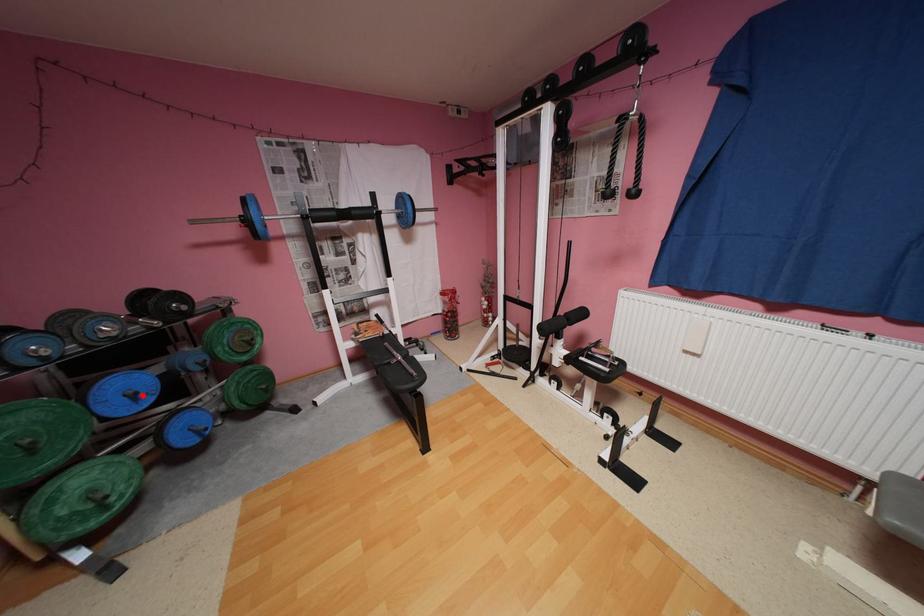
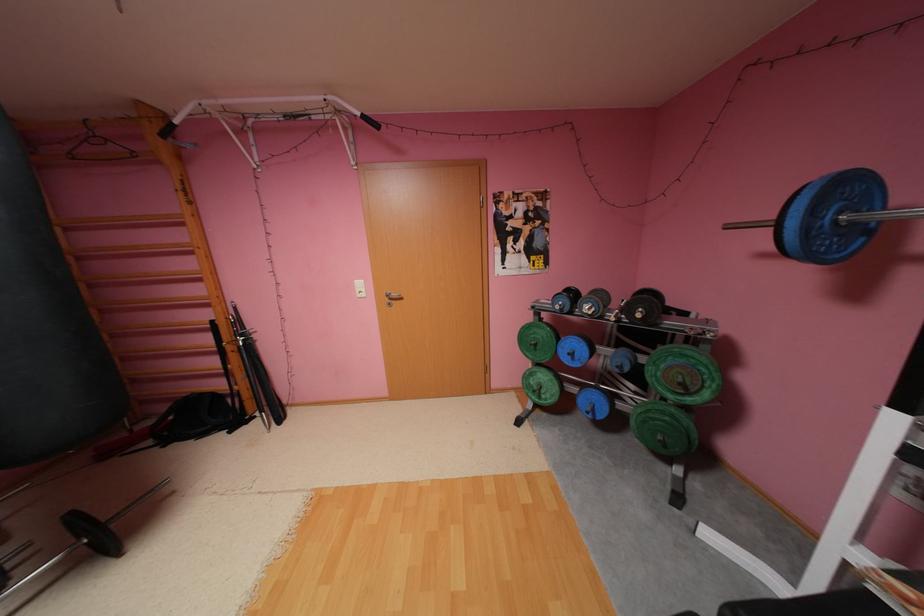
In the second image, find the point that corresponds to the highlighted location in the first image.

(580, 354)